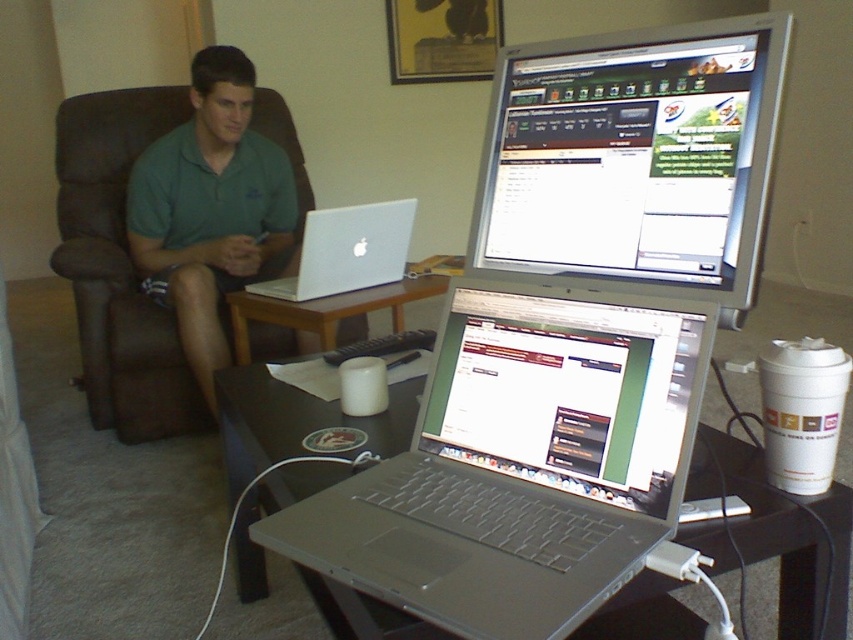
Is black glossy table at lower center to the right of wooden table at center from the viewer's perspective?

Indeed, black glossy table at lower center is positioned on the right side of wooden table at center.

Can you confirm if black glossy table at lower center is thinner than wooden table at center?

In fact, black glossy table at lower center might be wider than wooden table at center.

Who is more forward, (x=743, y=403) or (x=335, y=304)?

Point (x=335, y=304) is in front.

Where is `black glossy table at lower center`? black glossy table at lower center is located at coordinates (781, 532).

Which is above, silver metallic laptop at center or wooden table at center?

silver metallic laptop at center is above.

Is silver metallic laptop at center closer to camera compared to wooden table at center?

Yes, it is in front of wooden table at center.

The height and width of the screenshot is (640, 853). Describe the element at coordinates (347, 252) in the screenshot. I see `silver metallic laptop at center` at that location.

Find the location of a particular element. silver metallic laptop at center is located at coordinates (347, 252).

Describe the element at coordinates (634, 161) in the screenshot. The image size is (853, 640). I see `silver metallic monitor at upper right` at that location.

Image resolution: width=853 pixels, height=640 pixels. Find the location of `silver metallic monitor at upper right`. silver metallic monitor at upper right is located at coordinates (634, 161).

Does point (770, 129) come behind point (254, 208)?

No.

Identify the location of silver metallic monitor at upper right. Image resolution: width=853 pixels, height=640 pixels. (634, 161).